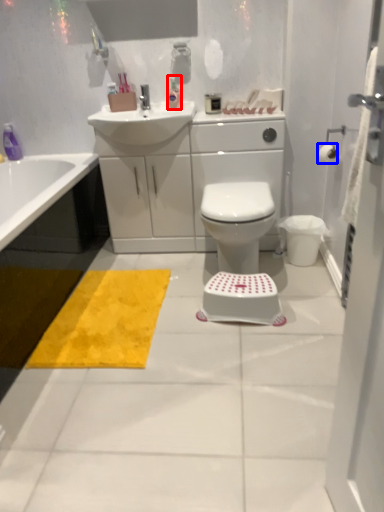
Question: Which point is further to the camera, toiletry (highlighted by a red box) or toilet paper (highlighted by a blue box)?

Choices:
 (A) toiletry
 (B) toilet paper

Answer: (A)